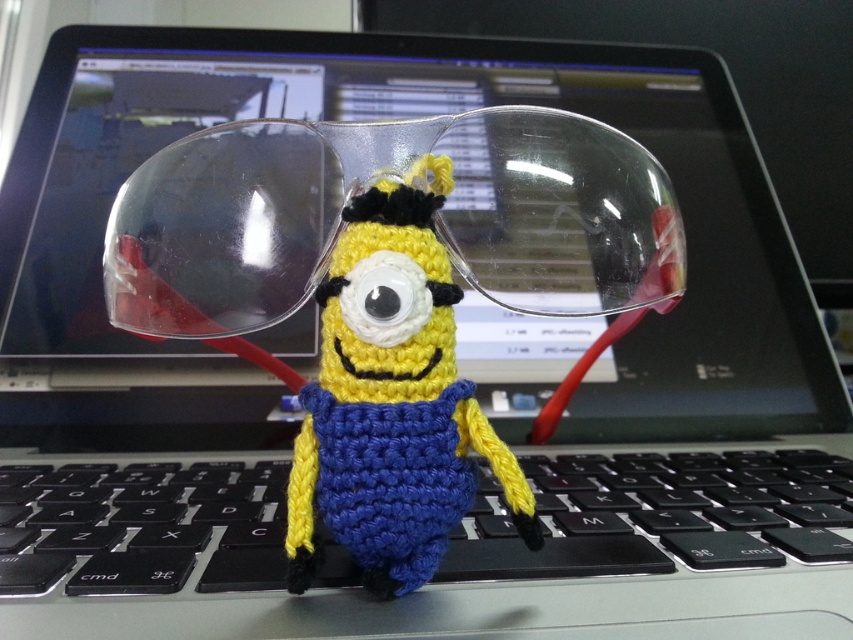
You are a photographer trying to capture the transparent plastic glasses at center in a closeup shot. Based on their position, where would you focus your camera lens to ensure they are in sharp focus?

The transparent plastic glasses at center are located at point [399,639], so you should focus your camera lens at that coordinate to ensure they are in sharp focus.

The transparent plastic glasses at center are positioned on the laptop screen. If you were to draw a straight line from the center of the screen to the glasses, would the glasses be located to the left, right, above, or below the center point of the screen?

The glasses are at point (399, 182). Since the center of the screen would be at (426, 320), the glasses are to the left and below the center point of the screen.